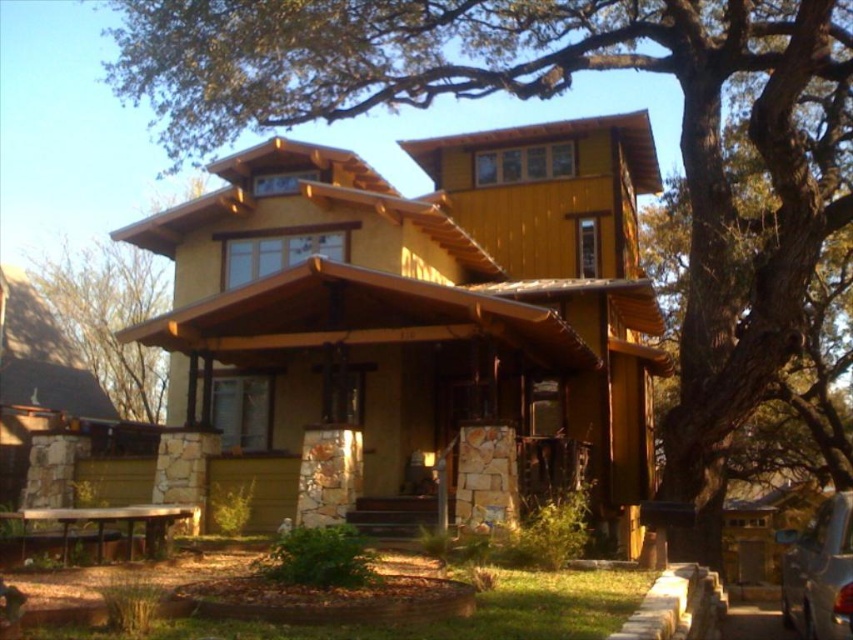
Is point (73, 291) closer to viewer compared to point (849, 614)?

No.

The height and width of the screenshot is (640, 853). Find the location of `green leafy tree at left`. green leafy tree at left is located at coordinates (109, 317).